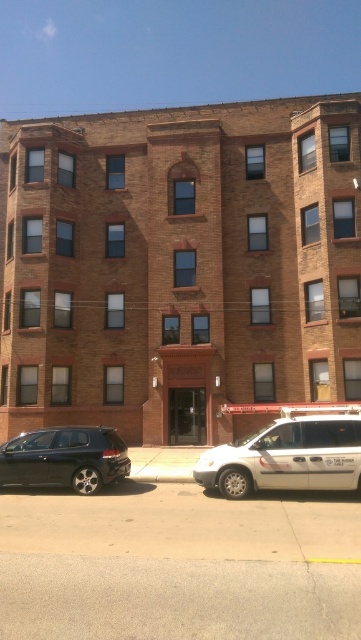
Question: Which point is farther to the camera?

Choices:
 (A) (118, 451)
 (B) (315, 458)

Answer: (A)

Question: Among these points, which one is nearest to the camera?

Choices:
 (A) (194, 468)
 (B) (54, 429)

Answer: (A)

Question: Where is white matte van at center located in relation to shiny black sedan at lower left in the image?

Choices:
 (A) above
 (B) below

Answer: (B)

Question: Does white matte van at center have a larger size compared to shiny black sedan at lower left?

Choices:
 (A) yes
 (B) no

Answer: (B)

Question: Does white matte van at center come behind shiny black sedan at lower left?

Choices:
 (A) yes
 (B) no

Answer: (B)

Question: Which object is farther from the camera taking this photo?

Choices:
 (A) white matte van at center
 (B) shiny black sedan at lower left

Answer: (B)